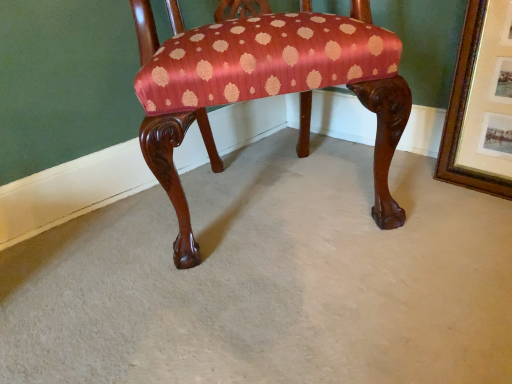
Question: Should I look upward or downward to see gold-framed picture at upper right?

Choices:
 (A) down
 (B) up

Answer: (B)

Question: Is silky red-patterned chair at center outside gold-framed picture at upper right?

Choices:
 (A) yes
 (B) no

Answer: (A)

Question: Is silky red-patterned chair at center to the left of gold-framed picture at upper right from the viewer's perspective?

Choices:
 (A) no
 (B) yes

Answer: (B)

Question: Can you confirm if silky red-patterned chair at center is wider than gold-framed picture at upper right?

Choices:
 (A) no
 (B) yes

Answer: (B)

Question: Is silky red-patterned chair at center oriented towards gold-framed picture at upper right?

Choices:
 (A) yes
 (B) no

Answer: (B)

Question: Would you say silky red-patterned chair at center contains gold-framed picture at upper right?

Choices:
 (A) yes
 (B) no

Answer: (B)

Question: From the image's perspective, is silky red-patterned chair at center beneath gold-framed picture at upper right?

Choices:
 (A) yes
 (B) no

Answer: (B)

Question: Is gold-framed picture at upper right closer to the viewer compared to silky red-patterned chair at center?

Choices:
 (A) no
 (B) yes

Answer: (A)

Question: Is gold-framed picture at upper right not near silky red-patterned chair at center?

Choices:
 (A) no
 (B) yes

Answer: (A)

Question: From the image's perspective, is gold-framed picture at upper right located beneath silky red-patterned chair at center?

Choices:
 (A) yes
 (B) no

Answer: (A)

Question: Is the surface of gold-framed picture at upper right in direct contact with silky red-patterned chair at center?

Choices:
 (A) no
 (B) yes

Answer: (A)

Question: Does gold-framed picture at upper right have a lesser width compared to silky red-patterned chair at center?

Choices:
 (A) yes
 (B) no

Answer: (A)

Question: Is gold-framed picture at upper right to the left of silky red-patterned chair at center from the viewer's perspective?

Choices:
 (A) no
 (B) yes

Answer: (A)

Question: Considering the positions of gold-framed picture at upper right and silky red-patterned chair at center in the image, is gold-framed picture at upper right wider or thinner than silky red-patterned chair at center?

Choices:
 (A) thin
 (B) wide

Answer: (A)